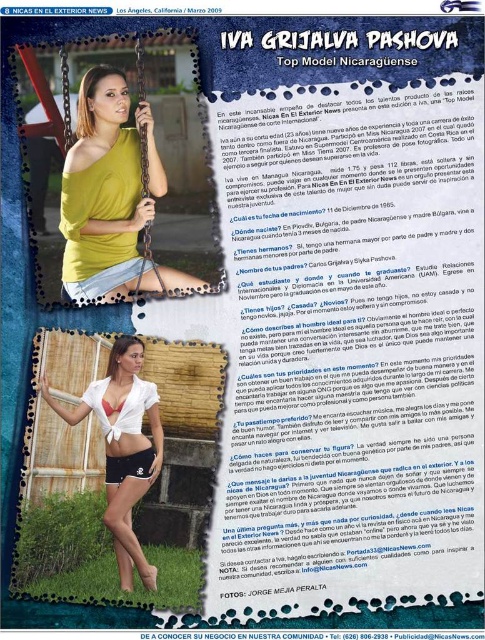
Question: Which object is farther from the camera taking this photo?

Choices:
 (A) mustard yellow jersey at center
 (B) white matte bikini top at center
 (C) matte white bikini top at center
 (D) black matte shorts at lower center

Answer: (B)

Question: Can you confirm if mustard yellow jersey at center is thinner than white matte bikini top at center?

Choices:
 (A) no
 (B) yes

Answer: (A)

Question: Considering the real-world distances, which object is farthest from the matte white bikini top at center?

Choices:
 (A) black matte shorts at lower center
 (B) mustard yellow jersey at center

Answer: (B)

Question: Does mustard yellow jersey at center appear on the left side of white matte bikini top at center?

Choices:
 (A) no
 (B) yes

Answer: (A)

Question: From the image, what is the correct spatial relationship of matte white bikini top at center in relation to black matte shorts at lower center?

Choices:
 (A) left
 (B) right

Answer: (A)

Question: Estimate the real-world distances between objects in this image. Which object is closer to the white matte bikini top at center?

Choices:
 (A) black matte shorts at lower center
 (B) mustard yellow jersey at center
 (C) matte white bikini top at center

Answer: (A)